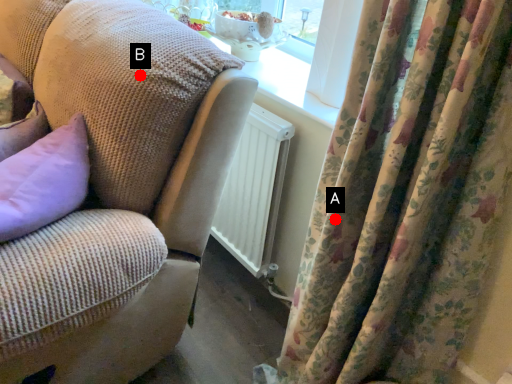
Question: Two points are circled on the image, labeled by A and B beside each circle. Which point is further to the camera?

Choices:
 (A) A is further
 (B) B is further

Answer: (B)